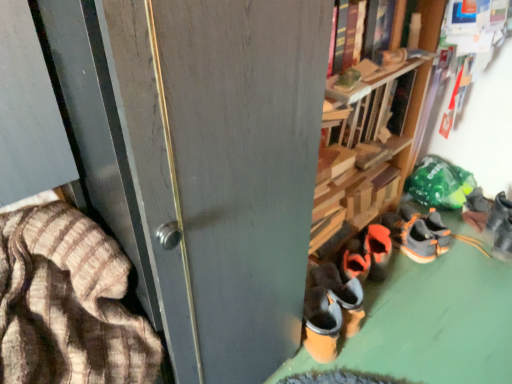
Locate an element on the screen. unoccupied region to the right of dark brown suede shoes at lower right, which ranks as the 5th footwear in right-to-left order is located at coordinates (400, 316).